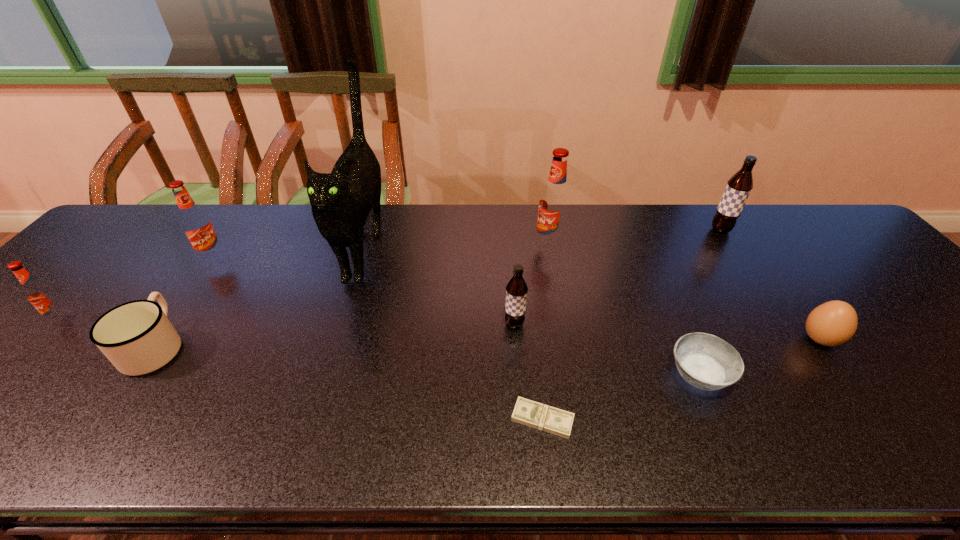
Image resolution: width=960 pixels, height=540 pixels. Identify the location of the smaller brown root beer. (516, 290).

At what (x,y) coordinates should I click in order to perform the action: click on the third root beer from left to right. Please return your answer as a coordinate pair (x, y). Looking at the image, I should click on (516, 290).

Where is `brown boiled egg`? The width and height of the screenshot is (960, 540). brown boiled egg is located at coordinates 833,323.

Where is `mug`? This screenshot has height=540, width=960. mug is located at coordinates (137, 337).

The width and height of the screenshot is (960, 540). Identify the location of the second shortest object. (707, 362).

This screenshot has width=960, height=540. Identify the location of the eighth object from left to right. (707, 362).

The width and height of the screenshot is (960, 540). What are the coordinates of `the shortest object` in the screenshot? It's located at (527, 412).

This screenshot has height=540, width=960. In order to click on free location located 0.130m on the face of the cat in this screenshot , I will do `click(334, 345)`.

Image resolution: width=960 pixels, height=540 pixels. I want to click on free space located on the right of the second tallest object, so click(601, 246).

Identify the location of free space located 0.290m on the front of the fourth root beer from right to left. This screenshot has width=960, height=540. (150, 347).